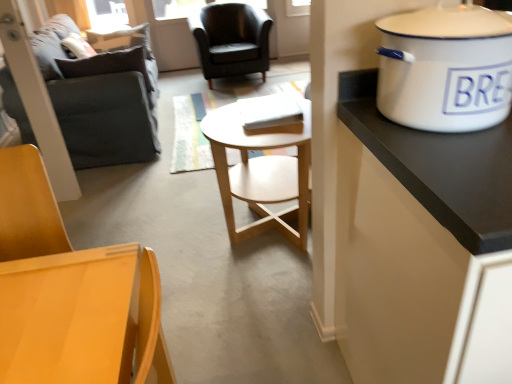
Question: Is matte black armchair at center, the 2th chair in the front-to-back sequence, to the left or to the right of matte wood chair at lower left, placed as the 1th chair when sorted from front to back, in the image?

Choices:
 (A) left
 (B) right

Answer: (B)

Question: Considering the positions of matte black armchair at center, which appears as the 2th chair when ordered from the bottom, and matte wood chair at lower left, positioned as the first chair in bottom-to-top order, in the image, is matte black armchair at center, which appears as the 2th chair when ordered from the bottom, taller or shorter than matte wood chair at lower left, positioned as the first chair in bottom-to-top order,?

Choices:
 (A) tall
 (B) short

Answer: (A)

Question: Which object is the closest to the light wood/woodenobject at center?

Choices:
 (A) white enamel cooker at upper right
 (B) matte black armchair at center, which appears as the first chair when viewed from the top
 (C) dark gray fabric couch at left
 (D) matte wood chair at lower left, the second chair viewed from the back

Answer: (A)

Question: Estimate the real-world distances between objects in this image. Which object is farther from the matte black armchair at center, which appears as the first chair when viewed from the top?

Choices:
 (A) dark gray fabric couch at left
 (B) matte wood chair at lower left, placed as the 1th chair when sorted from front to back
 (C) white enamel cooker at upper right
 (D) light wood/woodenobject at center

Answer: (C)